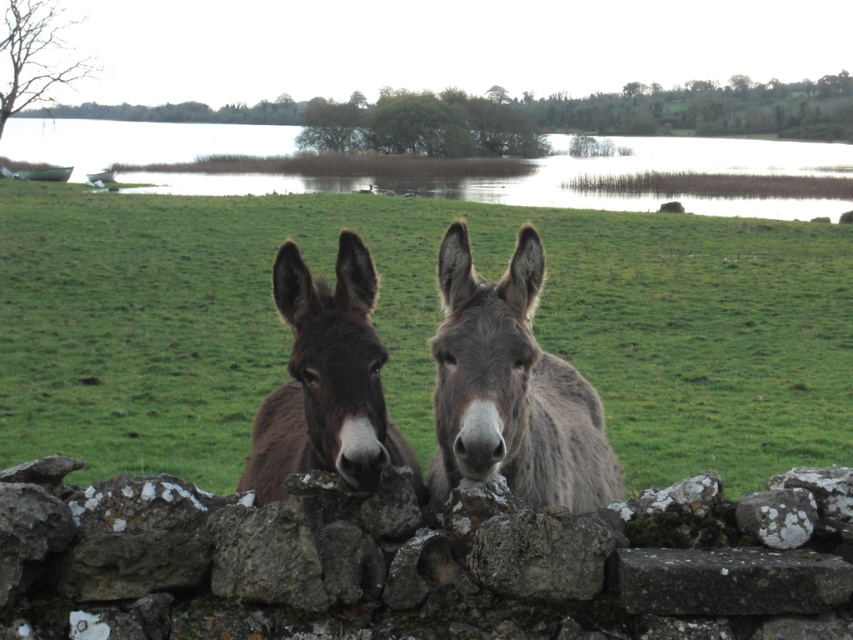
Question: Which object is the farthest from the green grass at upper center?

Choices:
 (A) gray fuzzy mule at center
 (B) brown fuzzy mule at center
 (C) white lichen-covered rock at center

Answer: (B)

Question: Can you confirm if green grass at upper center is smaller than white lichen-covered rock at center?

Choices:
 (A) no
 (B) yes

Answer: (A)

Question: Which object is the closest to the brown furry donkeys at center?

Choices:
 (A) gray fuzzy mule at center
 (B) green grass at upper center

Answer: (A)

Question: Considering the relative positions of gray fuzzy mule at center and white lichen-covered rock at center in the image provided, where is gray fuzzy mule at center located with respect to white lichen-covered rock at center?

Choices:
 (A) right
 (B) left

Answer: (B)

Question: Which point is farther to the camera?

Choices:
 (A) (161, 392)
 (B) (587, 481)

Answer: (A)

Question: Does brown fuzzy mule at center have a smaller size compared to white lichen-covered rock at center?

Choices:
 (A) yes
 (B) no

Answer: (B)